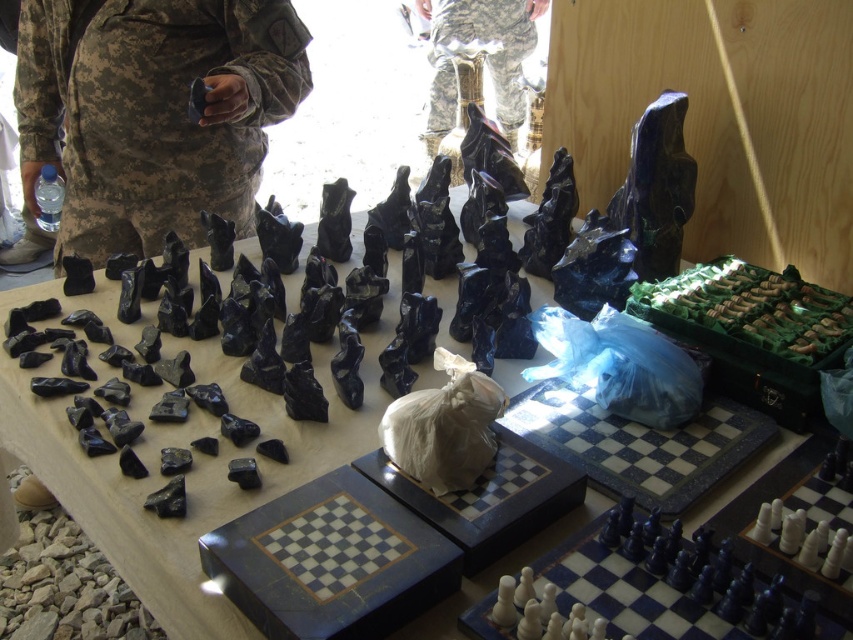
You are a chess player who wants to place a new chess piece on the board. The chessboard has coordinates from 0 to 1 in both x and y directions. The black stone chess pieces at center are already placed at point (x=178, y=445). If you want to place a new piece exactly 0.1 units to the right of this point, what would be the new coordinates?

The new coordinates would be 0.797, 0.211 because moving 0.1 units to the right increases the x coordinate by 0.1 while keeping the y coordinate the same.

You are a photographer setting up a shoot at the scene. You need to position a light source to the right of the camouflage fabric pants at center to highlight it. Will the light source also illuminate the black stone chess pieces at center?

The black stone chess pieces at center is to the left of camouflage fabric pants at center, so placing the light source to the right of the camouflage fabric pants at center may not directly illuminate the black stone chess pieces at center unless the light is positioned in a way that casts a broad or indirect light.

From the picture: You are an observer looking at the scene described. Which item, the camouflage fabric uniform at center or the camouflage fabric pants at center, is shorter in height?

The camouflage fabric uniform at center is shorter in height than the camouflage fabric pants at center.